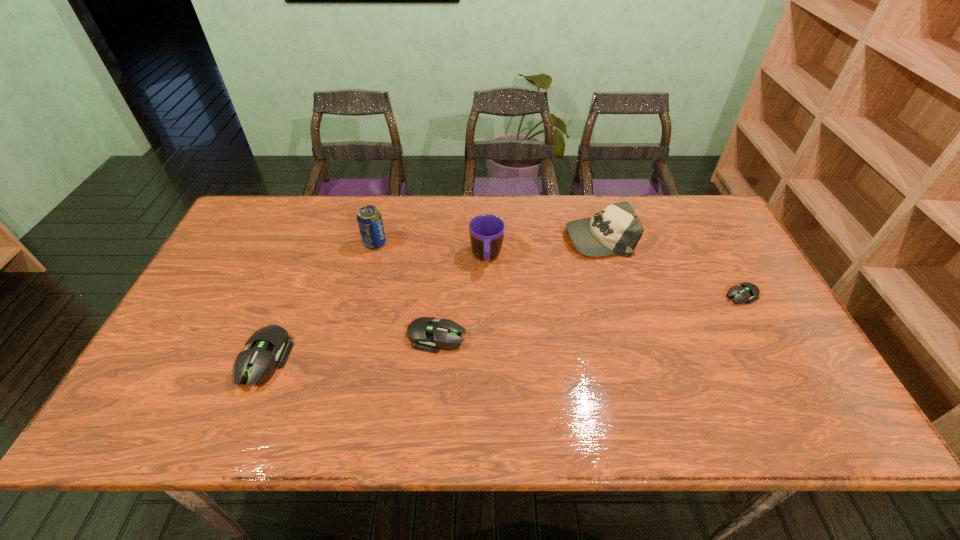
At what (x,y) coordinates should I click in order to perform the action: click on free space located 0.360m on the back of the third object from left to right. Please return your answer as a coordinate pair (x, y). Image resolution: width=960 pixels, height=540 pixels. Looking at the image, I should click on (445, 231).

Locate an element on the screen. vacant space located 0.260m on the front of the farthest computer mouse is located at coordinates (794, 392).

The width and height of the screenshot is (960, 540). Find the location of `vacant space situated 0.260m on the front-facing side of the third tallest object`. vacant space situated 0.260m on the front-facing side of the third tallest object is located at coordinates (482, 237).

Locate an element on the screen. vacant region located on the front-facing side of the third tallest object is located at coordinates (537, 237).

In order to click on free space located 0.210m on the front-facing side of the third tallest object in this screenshot , I will do `click(498, 237)`.

The width and height of the screenshot is (960, 540). In order to click on vacant space located 0.080m on the front of the second object from left to right in this screenshot , I will do pos(369,270).

In order to click on vacant space located 0.370m with the handle on the side of the mug in this screenshot , I will do `click(489, 390)`.

Locate an element on the screen. baseball cap situated at the far edge is located at coordinates (616, 230).

Identify the location of soda at the far edge. (369, 219).

Image resolution: width=960 pixels, height=540 pixels. Identify the location of mug situated at the far edge. (486, 231).